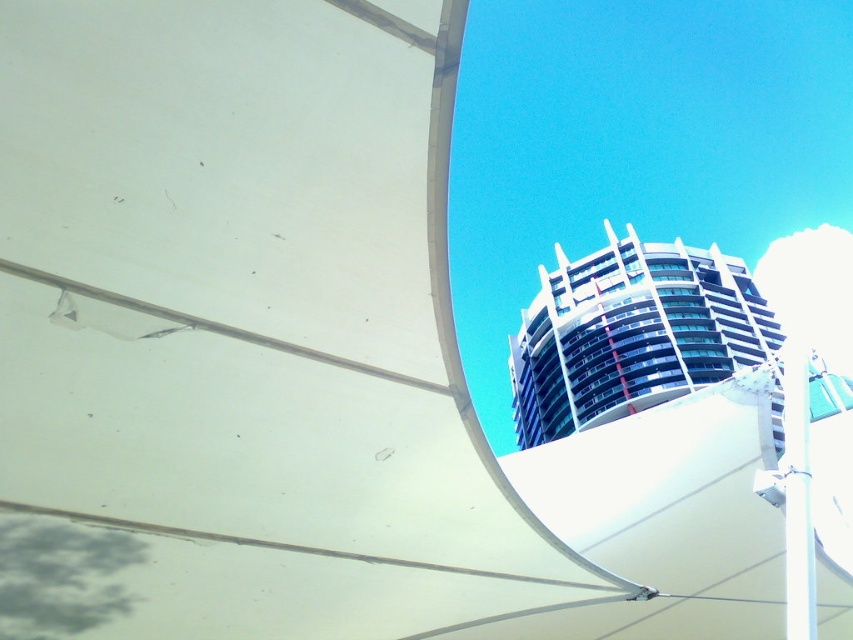
Question: Is white glass building at upper center above white glossy pole at right?

Choices:
 (A) no
 (B) yes

Answer: (A)

Question: Which of the following is the farthest from the observer?

Choices:
 (A) (815, 588)
 (B) (524, 314)

Answer: (B)

Question: Is white glass building at upper center in front of white glossy pole at right?

Choices:
 (A) no
 (B) yes

Answer: (A)

Question: Does white glass building at upper center appear on the right side of white glossy pole at right?

Choices:
 (A) no
 (B) yes

Answer: (B)

Question: Among these objects, which one is farthest from the camera?

Choices:
 (A) white glass building at upper center
 (B) white glossy pole at right

Answer: (A)

Question: Which point is closer to the camera taking this photo?

Choices:
 (A) (786, 541)
 (B) (776, 406)

Answer: (A)